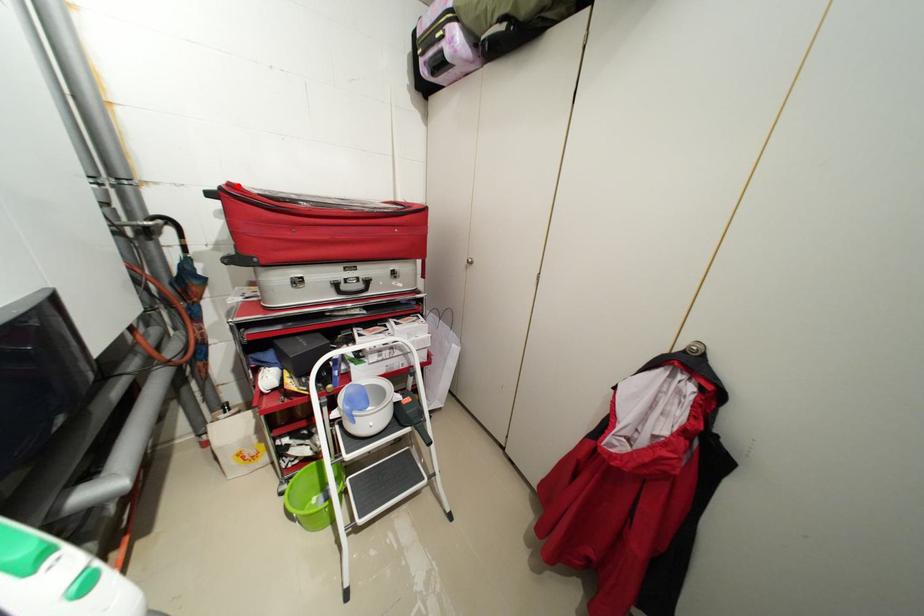
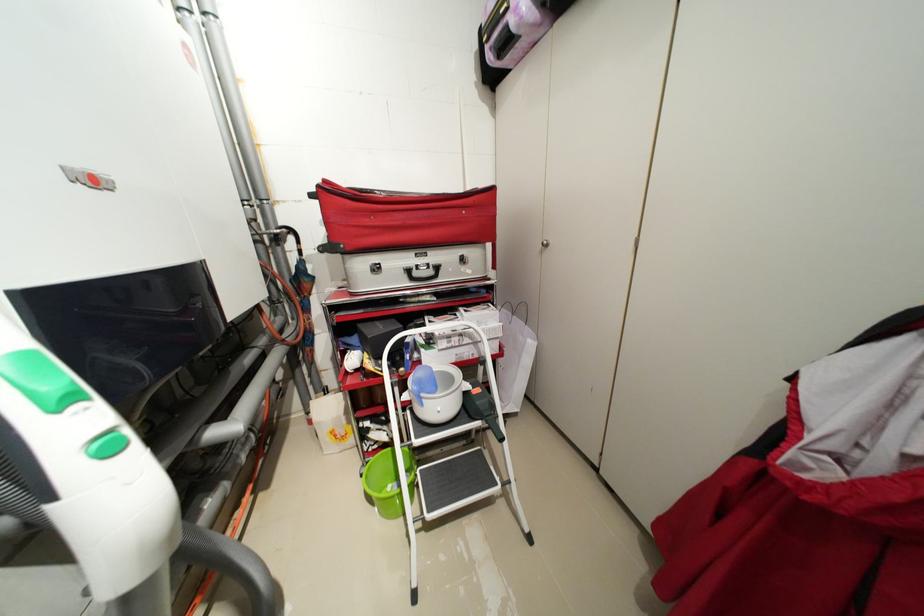
In the second image, find the point that corresponds to the highlighted location in the first image.

(332, 182)